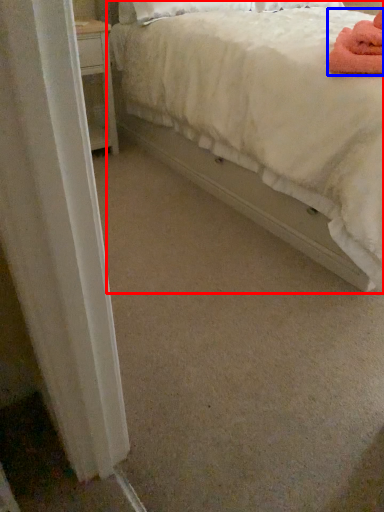
Question: Which object is closer to the camera taking this photo, bed (highlighted by a red box) or bath towel (highlighted by a blue box)?

Choices:
 (A) bed
 (B) bath towel

Answer: (A)